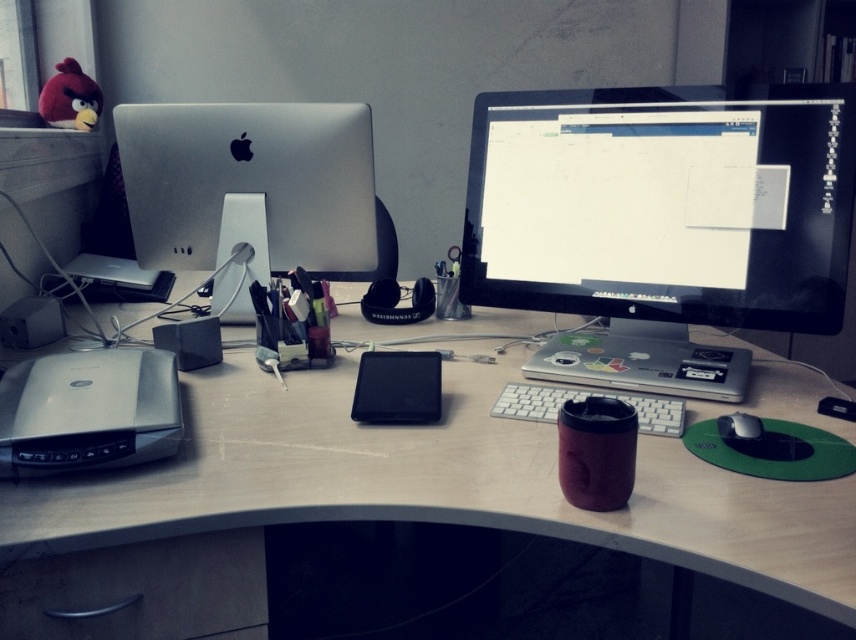
Question: Is white plastic speaker at center closer to the viewer compared to white plastic keyboard at center?

Choices:
 (A) yes
 (B) no

Answer: (B)

Question: Can you confirm if wooden desk at center is positioned to the left of black matte mouse at center right?

Choices:
 (A) no
 (B) yes

Answer: (B)

Question: Can you confirm if white plastic keyboard at center is smaller than black matte mouse at center right?

Choices:
 (A) no
 (B) yes

Answer: (A)

Question: Which of these objects is positioned farthest from the white plastic speaker at center?

Choices:
 (A) matte black monitor at center
 (B) black matte mouse at center right

Answer: (B)

Question: Which object is positioned closest to the black matte mouse at center right?

Choices:
 (A) matte black monitor at center
 (B) white plastic keyboard at center
 (C) white plastic speaker at center

Answer: (B)

Question: Which point is farther to the camera?

Choices:
 (A) black matte mouse at center right
 (B) wooden desk at center
 (C) white plastic keyboard at center
 (D) matte black monitor at center

Answer: (D)